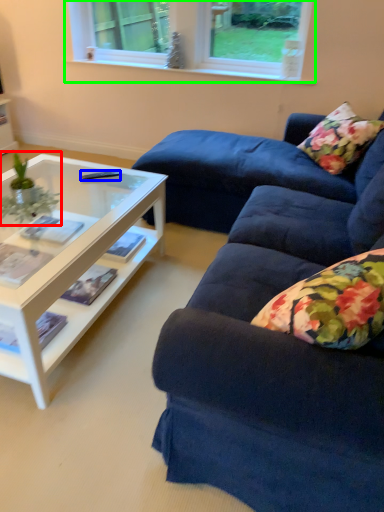
Question: Which is farther away from houseplant (highlighted by a red box)? remote control (highlighted by a blue box) or window (highlighted by a green box)?

Choices:
 (A) remote control
 (B) window

Answer: (B)